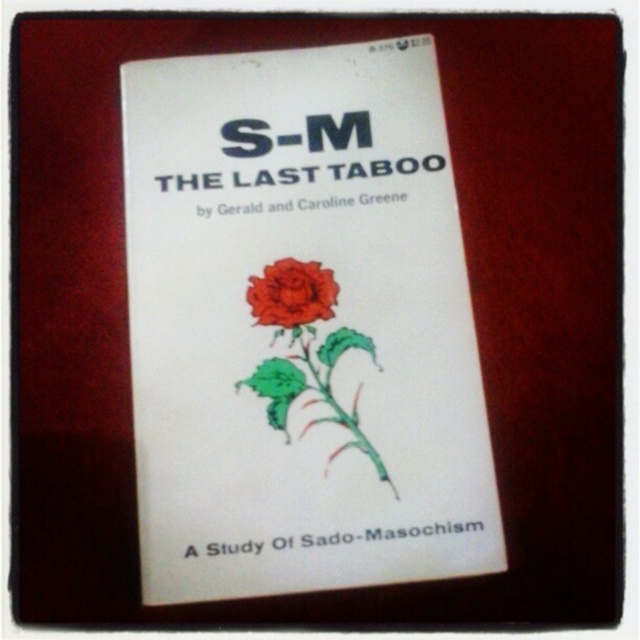
Question: Is white paper book at center in front of matte red rose at center?

Choices:
 (A) yes
 (B) no

Answer: (A)

Question: Which point is farther to the camera?

Choices:
 (A) (317, 289)
 (B) (429, 180)

Answer: (B)

Question: Is white paper book at center smaller than matte red rose at center?

Choices:
 (A) yes
 (B) no

Answer: (B)

Question: Which point is farther to the camera?

Choices:
 (A) white paper book at center
 (B) matte red rose at center

Answer: (B)

Question: Does white paper book at center come in front of matte red rose at center?

Choices:
 (A) yes
 (B) no

Answer: (A)